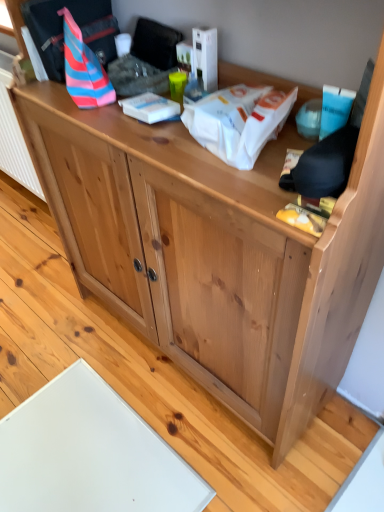
Question: From the image's perspective, is striped fabric bag at upper left, the 2th kit viewed from the right, below white paper at upper center, the 2th kit from the left?

Choices:
 (A) yes
 (B) no

Answer: (B)

Question: Are striped fabric bag at upper left, the 2th kit viewed from the right, and white paper at upper center, arranged as the first kit when viewed from the right, making contact?

Choices:
 (A) no
 (B) yes

Answer: (A)

Question: Is striped fabric bag at upper left, marked as the 1th kit in a left-to-right arrangement, turned away from white paper at upper center, arranged as the first kit when viewed from the right?

Choices:
 (A) yes
 (B) no

Answer: (B)

Question: Is striped fabric bag at upper left, marked as the 1th kit in a left-to-right arrangement, positioned far away from white paper at upper center, the 2th kit from the left?

Choices:
 (A) yes
 (B) no

Answer: (B)

Question: From the image's perspective, is striped fabric bag at upper left, the 2th kit viewed from the right, on top of white paper at upper center, arranged as the first kit when viewed from the right?

Choices:
 (A) yes
 (B) no

Answer: (A)

Question: Considering the relative sizes of striped fabric bag at upper left, the 2th kit viewed from the right, and white paper at upper center, the 2th kit from the left, in the image provided, is striped fabric bag at upper left, the 2th kit viewed from the right, smaller than white paper at upper center, the 2th kit from the left,?

Choices:
 (A) yes
 (B) no

Answer: (B)

Question: Is white paper at upper center, the 2th kit from the left, looking in the opposite direction of striped fabric bag at upper left, the 2th kit viewed from the right?

Choices:
 (A) yes
 (B) no

Answer: (B)

Question: Is white paper at upper center, the 2th kit from the left, further to camera compared to striped fabric bag at upper left, the 2th kit viewed from the right?

Choices:
 (A) yes
 (B) no

Answer: (B)

Question: Does white paper at upper center, arranged as the first kit when viewed from the right, have a lesser height compared to striped fabric bag at upper left, marked as the 1th kit in a left-to-right arrangement?

Choices:
 (A) yes
 (B) no

Answer: (A)

Question: From a real-world perspective, is white paper at upper center, the 2th kit from the left, on striped fabric bag at upper left, marked as the 1th kit in a left-to-right arrangement?

Choices:
 (A) yes
 (B) no

Answer: (B)

Question: Does white paper at upper center, arranged as the first kit when viewed from the right, have a greater height compared to striped fabric bag at upper left, marked as the 1th kit in a left-to-right arrangement?

Choices:
 (A) yes
 (B) no

Answer: (B)

Question: From the image's perspective, does white paper at upper center, arranged as the first kit when viewed from the right, appear lower than striped fabric bag at upper left, marked as the 1th kit in a left-to-right arrangement?

Choices:
 (A) no
 (B) yes

Answer: (B)

Question: From a real-world perspective, is striped fabric bag at upper left, the 2th kit viewed from the right, physically located above or below white paper at upper center, the 2th kit from the left?

Choices:
 (A) below
 (B) above

Answer: (B)